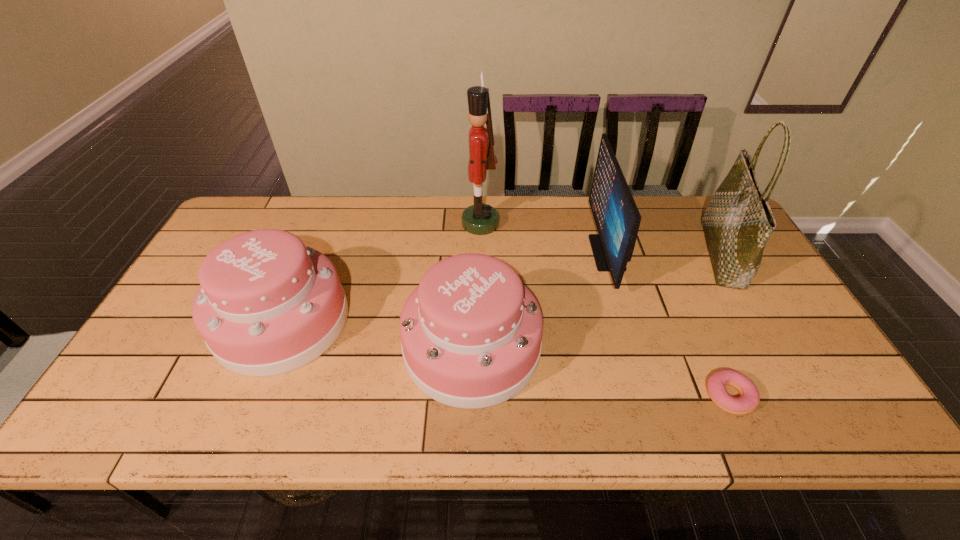
Where is `object that is the fourth closest one to the nutcracker`? This screenshot has width=960, height=540. object that is the fourth closest one to the nutcracker is located at coordinates (738, 221).

The image size is (960, 540). I want to click on object that is the fourth closest one to the doughnut, so click(x=479, y=219).

Find the location of a particular element. Image resolution: width=960 pixels, height=540 pixels. vacant space that satisfies the following two spatial constraints: 1. on the front side of the doughnut; 2. on the right side of the birthday cake is located at coordinates (252, 396).

Locate an element on the screen. The image size is (960, 540). blank area in the image that satisfies the following two spatial constraints: 1. on the screen side of the shopping bag; 2. on the right side of the third object from right to left is located at coordinates (607, 254).

Where is `vacant area that satisfies the following two spatial constraints: 1. on the screen side of the computer monitor; 2. on the left side of the doughnut`? The image size is (960, 540). vacant area that satisfies the following two spatial constraints: 1. on the screen side of the computer monitor; 2. on the left side of the doughnut is located at coordinates (650, 396).

Find the location of `free location that satisfies the following two spatial constraints: 1. on the front-facing side of the rightmost object; 2. on the right side of the nutcracker`. free location that satisfies the following two spatial constraints: 1. on the front-facing side of the rightmost object; 2. on the right side of the nutcracker is located at coordinates (480, 254).